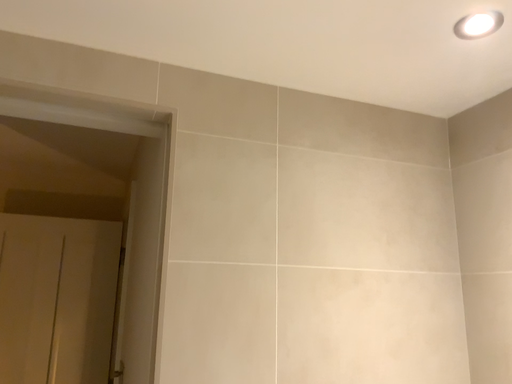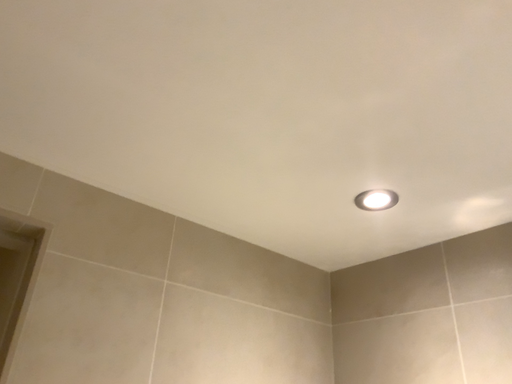
Question: Which way did the camera rotate in the video?

Choices:
 (A) rotated downward
 (B) rotated upward

Answer: (B)